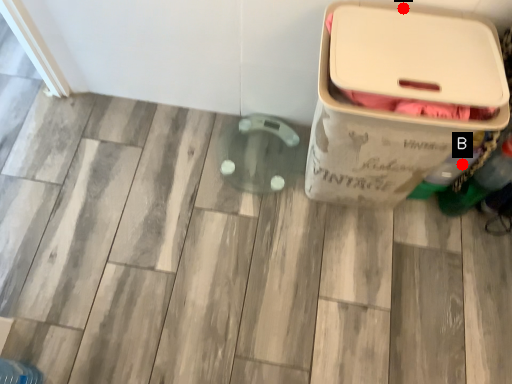
Question: Two points are circled on the image, labeled by A and B beside each circle. Which point is closer to the camera taking this photo?

Choices:
 (A) A is closer
 (B) B is closer

Answer: (A)